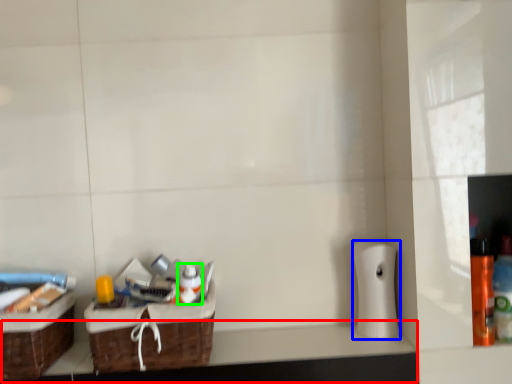
Question: Based on their relative distances, which object is farther from counter top (highlighted by a red box)? Choose from toilet paper (highlighted by a blue box) and mouthwash (highlighted by a green box).

Choices:
 (A) toilet paper
 (B) mouthwash

Answer: (B)